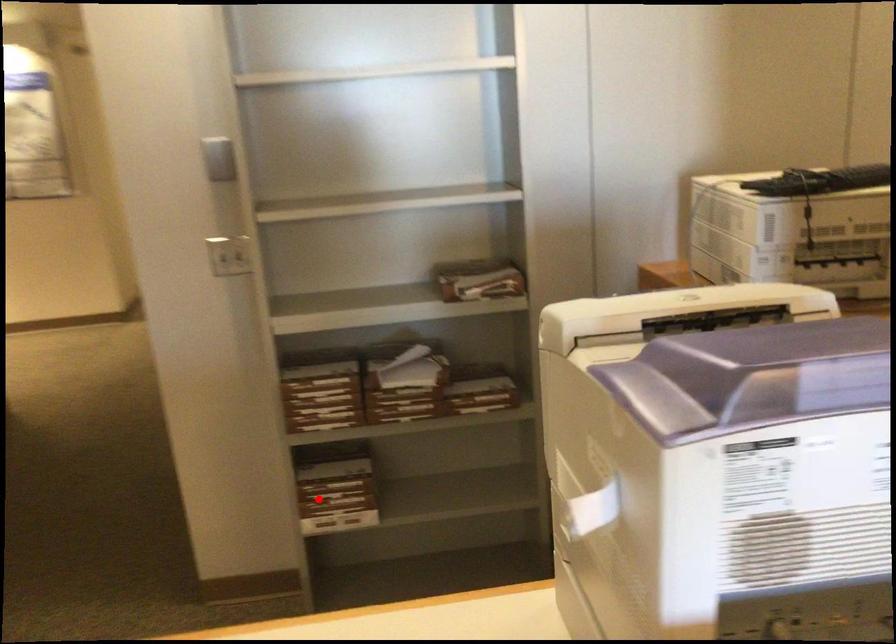
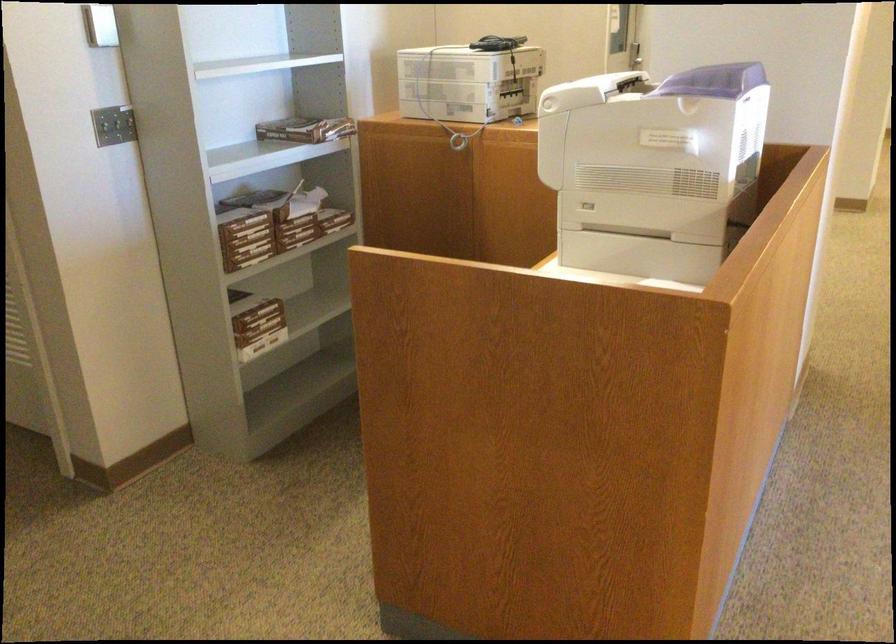
Question: I am providing you with two images of the same scene from different viewpoints. In image1, a red point is highlighted. Considering the same 3D point in image2, which of the following is correct?

Choices:
 (A) It is closer
 (B) It is farther

Answer: (B)